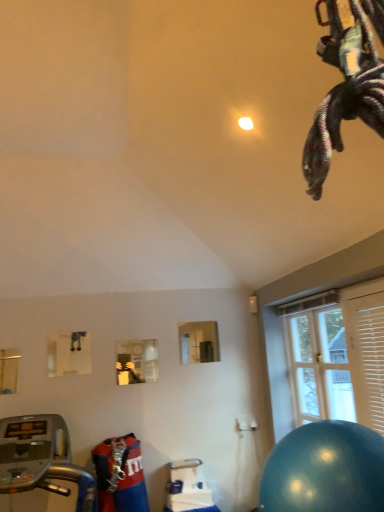
Question: In the image, is wooden blinds at right on the left side or the right side of silver metallic treadmill at lower left?

Choices:
 (A) left
 (B) right

Answer: (B)

Question: Would you say wooden blinds at right is inside or outside silver metallic treadmill at lower left?

Choices:
 (A) inside
 (B) outside

Answer: (B)

Question: Which object is positioned closest to the wooden blinds at right?

Choices:
 (A) clear glass door at right
 (B) shiny blue ball at lower right
 (C) silver metallic treadmill at lower left

Answer: (B)

Question: Considering the real-world distances, which object is closest to the silver metallic treadmill at lower left?

Choices:
 (A) wooden blinds at right
 (B) clear glass door at right
 (C) shiny blue ball at lower right

Answer: (C)